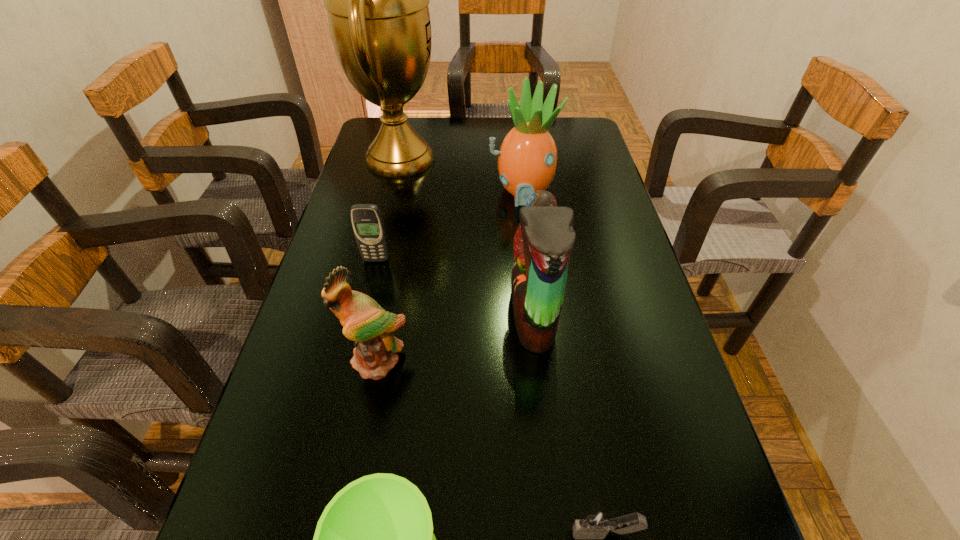
Find the location of `vacant position at the far right corner of the desktop`. vacant position at the far right corner of the desktop is located at coordinates (557, 116).

Locate an element on the screen. free spot between the cellular telephone and the tallest object is located at coordinates (388, 210).

Image resolution: width=960 pixels, height=540 pixels. I want to click on free space between the trophy cup and the left parrot, so click(x=388, y=260).

Locate an element on the screen. This screenshot has width=960, height=540. vacant space in between the cellular telephone and the trophy cup is located at coordinates (388, 210).

Identify which object is the third closest to the wineglass. Please provide its 2D coordinates. Your answer should be formatted as a tuple, i.e. [(x, y)], where the tuple contains the x and y coordinates of a point satisfying the conditions above.

[(542, 245)]

At what (x,y) coordinates should I click in order to perform the action: click on the third closest object to the right parrot. Please return your answer as a coordinate pair (x, y). Looking at the image, I should click on (596, 524).

Identify the location of vacant space that satisfies the following two spatial constraints: 1. on the surface of the tallest object with symbols; 2. on the screen of the cellular telephone. [x=376, y=260].